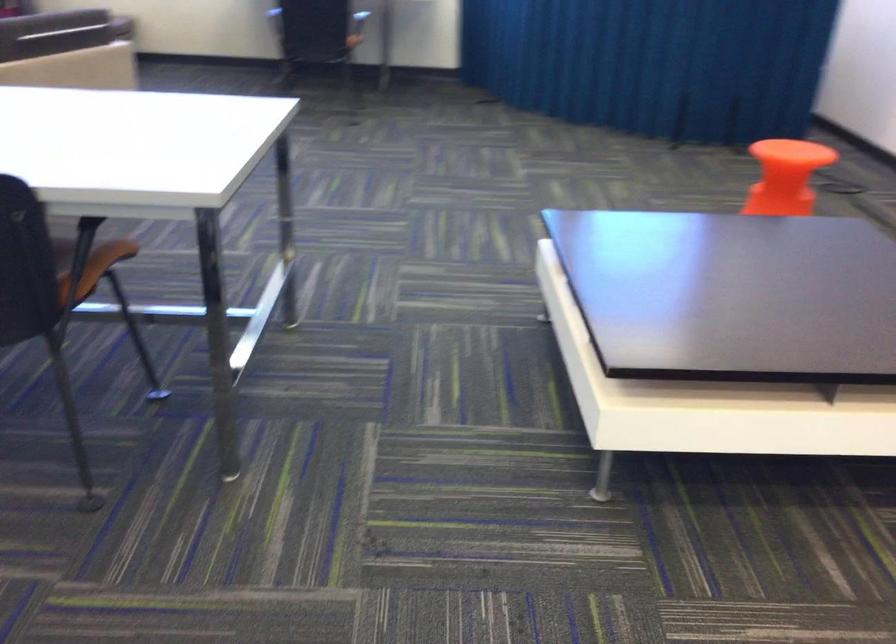
This screenshot has width=896, height=644. What are the coordinates of `brown chair sitting surface` in the screenshot? It's located at (62, 252).